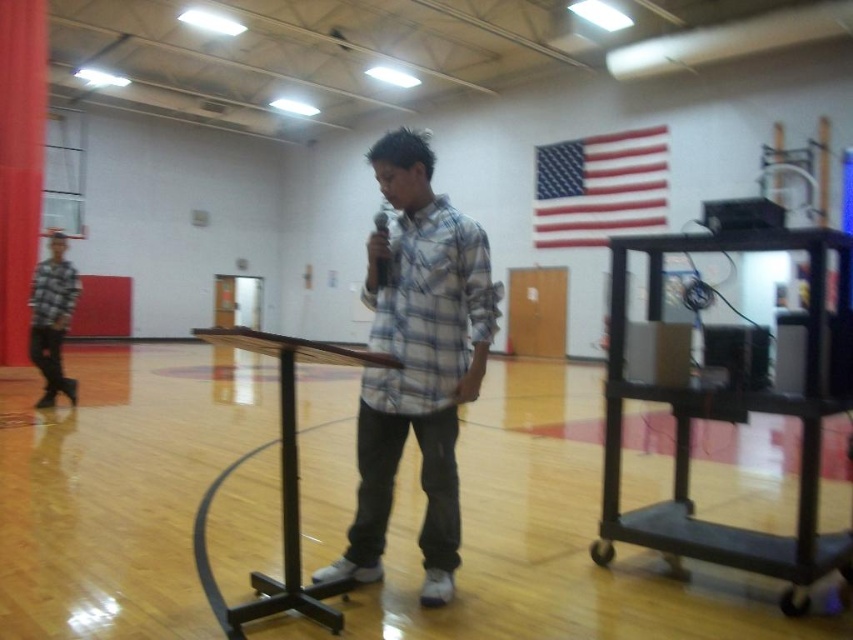
You are standing at the entrance of the gymnasium and want to place a new banner to the right of the black metal cart at center. Where should you position the banner relative to the red fabric flag at upper right?

The banner should be placed to the left of the red fabric flag at upper right because the black metal cart at center is already positioned to the left of the red fabric flag at upper right.